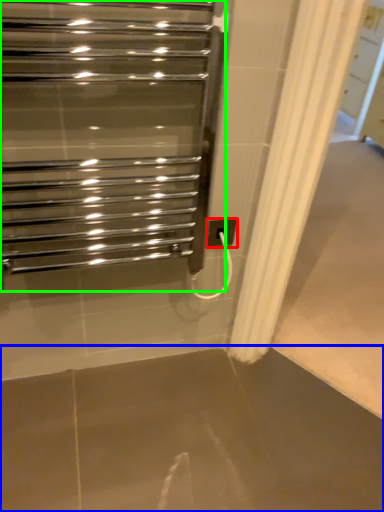
Question: Based on their relative distances, which object is farther from electric outlet (highlighted by a red box)? Choose from concrete (highlighted by a blue box) and home appliance (highlighted by a green box).

Choices:
 (A) concrete
 (B) home appliance

Answer: (A)